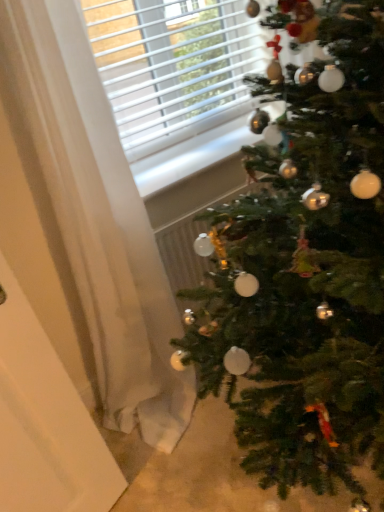
Question: Are green matte christmas tree at right and white sheer curtain at left beside each other?

Choices:
 (A) no
 (B) yes

Answer: (A)

Question: From a real-world perspective, is green matte christmas tree at right on top of white sheer curtain at left?

Choices:
 (A) yes
 (B) no

Answer: (B)

Question: Considering the relative sizes of green matte christmas tree at right and white sheer curtain at left in the image provided, is green matte christmas tree at right shorter than white sheer curtain at left?

Choices:
 (A) no
 (B) yes

Answer: (B)

Question: Is green matte christmas tree at right outside of white sheer curtain at left?

Choices:
 (A) no
 (B) yes

Answer: (B)

Question: Is green matte christmas tree at right turned away from white sheer curtain at left?

Choices:
 (A) yes
 (B) no

Answer: (A)

Question: Considering the relative sizes of green matte christmas tree at right and white sheer curtain at left in the image provided, is green matte christmas tree at right taller than white sheer curtain at left?

Choices:
 (A) yes
 (B) no

Answer: (B)

Question: Considering the relative sizes of white sheer curtain at left and white matte screen door at left in the image provided, is white sheer curtain at left wider than white matte screen door at left?

Choices:
 (A) no
 (B) yes

Answer: (B)

Question: Would you say white sheer curtain at left is a long distance from white matte screen door at left?

Choices:
 (A) yes
 (B) no

Answer: (B)

Question: Is white sheer curtain at left facing towards white matte screen door at left?

Choices:
 (A) no
 (B) yes

Answer: (A)

Question: Considering the relative sizes of white sheer curtain at left and white matte screen door at left in the image provided, is white sheer curtain at left taller than white matte screen door at left?

Choices:
 (A) no
 (B) yes

Answer: (B)

Question: Can we say white sheer curtain at left lies outside white matte screen door at left?

Choices:
 (A) no
 (B) yes

Answer: (B)

Question: Does white sheer curtain at left contain white matte screen door at left?

Choices:
 (A) no
 (B) yes

Answer: (A)

Question: From the image's perspective, is green matte christmas tree at right below white matte screen door at left?

Choices:
 (A) no
 (B) yes

Answer: (A)